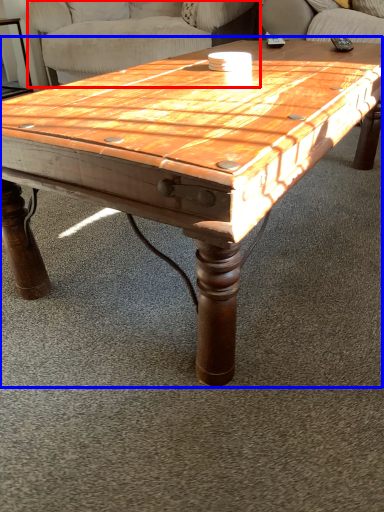
Question: Among these objects, which one is nearest to the camera, swivel chair (highlighted by a red box) or coffee table (highlighted by a blue box)?

Choices:
 (A) swivel chair
 (B) coffee table

Answer: (B)